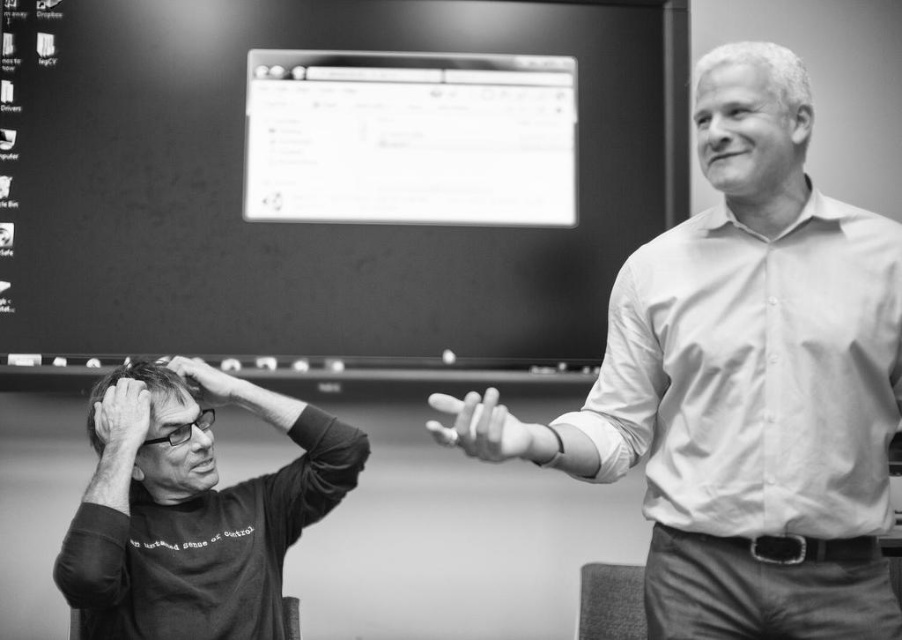
Does matte black monitor at upper center have a greater height compared to white smooth face at upper right?

Correct, matte black monitor at upper center is much taller as white smooth face at upper right.

From the picture: Is matte black monitor at upper center above white smooth face at upper right?

Correct, matte black monitor at upper center is located above white smooth face at upper right.

What do you see at coordinates (330, 184) in the screenshot? Image resolution: width=902 pixels, height=640 pixels. I see `matte black monitor at upper center` at bounding box center [330, 184].

At what (x,y) coordinates should I click in order to perform the action: click on matte black monitor at upper center. Please return your answer as a coordinate pair (x, y). This screenshot has height=640, width=902. Looking at the image, I should click on (330, 184).

Can you confirm if dark gray shirt at left is positioned to the left of smooth skin forehead at upper center?

Correct, you'll find dark gray shirt at left to the left of smooth skin forehead at upper center.

Between point (315, 467) and point (698, 61), which one is positioned in front?

Point (698, 61)

What are the coordinates of `dark gray shirt at left` in the screenshot? It's located at (192, 513).

This screenshot has width=902, height=640. I want to click on dark gray shirt at left, so click(192, 513).

Who is lower down, smooth skin hand at center or smooth skin hand at upper center?

smooth skin hand at center is below.

Image resolution: width=902 pixels, height=640 pixels. What do you see at coordinates (484, 428) in the screenshot? I see `smooth skin hand at center` at bounding box center [484, 428].

The image size is (902, 640). What do you see at coordinates (484, 428) in the screenshot?
I see `smooth skin hand at center` at bounding box center [484, 428].

Image resolution: width=902 pixels, height=640 pixels. Identify the location of smooth skin hand at center. (484, 428).